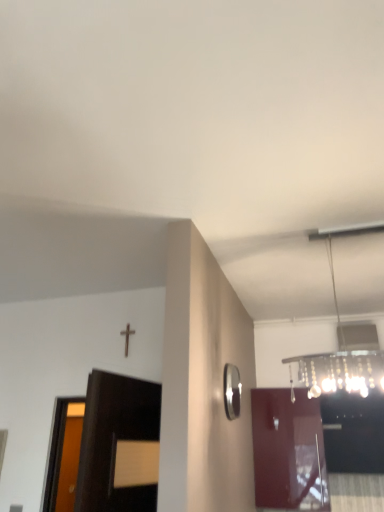
Question: Does glossy wood door at center appear on the right side of clear glass chandelier at upper right?

Choices:
 (A) no
 (B) yes

Answer: (B)

Question: Is glossy wood door at center turned away from clear glass chandelier at upper right?

Choices:
 (A) yes
 (B) no

Answer: (B)

Question: Does glossy wood door at center turn towards clear glass chandelier at upper right?

Choices:
 (A) no
 (B) yes

Answer: (B)

Question: Is glossy wood door at center far from clear glass chandelier at upper right?

Choices:
 (A) no
 (B) yes

Answer: (A)

Question: From a real-world perspective, is glossy wood door at center located beneath clear glass chandelier at upper right?

Choices:
 (A) no
 (B) yes

Answer: (B)

Question: Is polished silver mirror at right wider or thinner than clear glass chandelier at upper right?

Choices:
 (A) wide
 (B) thin

Answer: (B)

Question: Based on their positions, is polished silver mirror at right located to the left or right of clear glass chandelier at upper right?

Choices:
 (A) right
 (B) left

Answer: (B)

Question: In the image, is polished silver mirror at right positioned in front of or behind clear glass chandelier at upper right?

Choices:
 (A) front
 (B) behind

Answer: (B)

Question: From a real-world perspective, is polished silver mirror at right physically located above or below clear glass chandelier at upper right?

Choices:
 (A) below
 (B) above

Answer: (A)

Question: In terms of width, does clear glass chandelier at upper right look wider or thinner when compared to polished silver mirror at right?

Choices:
 (A) wide
 (B) thin

Answer: (A)

Question: Is clear glass chandelier at upper right in front of or behind polished silver mirror at right in the image?

Choices:
 (A) behind
 (B) front

Answer: (B)

Question: In terms of height, does clear glass chandelier at upper right look taller or shorter compared to polished silver mirror at right?

Choices:
 (A) tall
 (B) short

Answer: (A)

Question: From the image's perspective, relative to polished silver mirror at right, is clear glass chandelier at upper right above or below?

Choices:
 (A) below
 (B) above

Answer: (B)

Question: In the image, is glossy wood door at center positioned in front of or behind polished silver mirror at right?

Choices:
 (A) behind
 (B) front

Answer: (A)

Question: Considering the positions of glossy wood door at center and polished silver mirror at right in the image, is glossy wood door at center wider or thinner than polished silver mirror at right?

Choices:
 (A) wide
 (B) thin

Answer: (A)